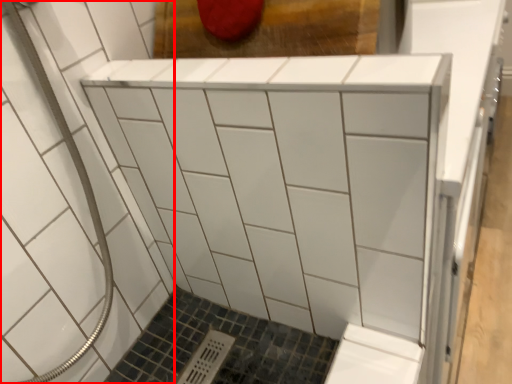
Question: Observing the image, what is the correct spatial positioning of bath (annotated by the red box) in reference to furniture?

Choices:
 (A) right
 (B) left

Answer: (B)